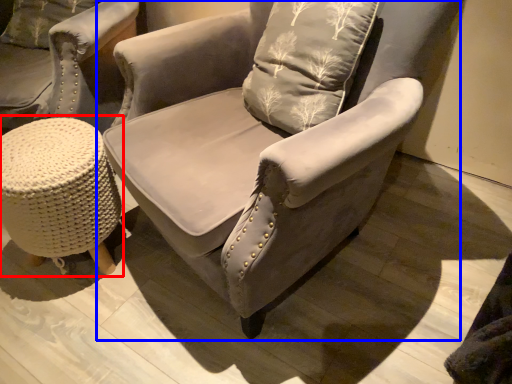
Question: Among these objects, which one is farthest to the camera, music stool (highlighted by a red box) or chair (highlighted by a blue box)?

Choices:
 (A) music stool
 (B) chair

Answer: (A)